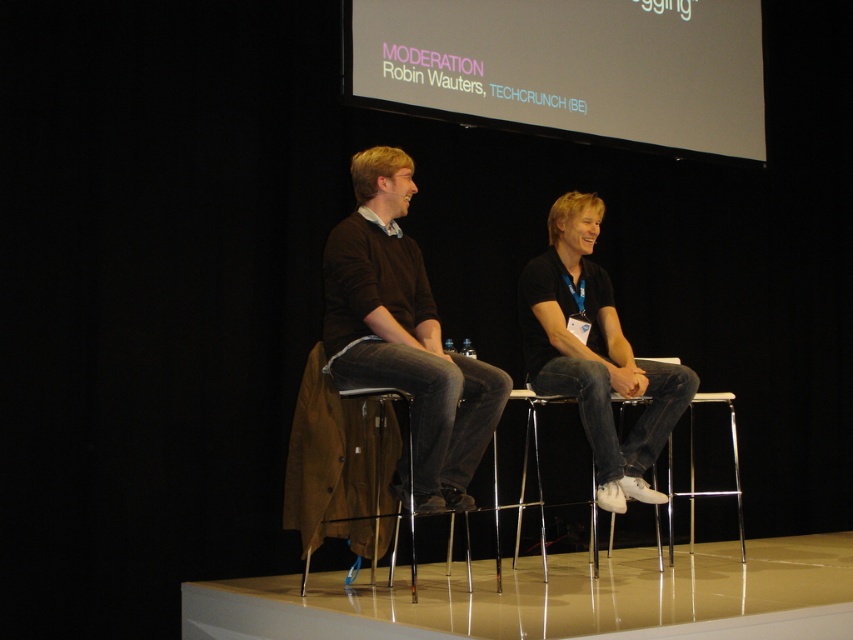
You are an event organizer who needs to ensure that the white matte projection screen at upper center and the matte brown sweater at center are at least 6 feet apart for safety protocols. Based on the scene, can you confirm if they meet the required distance?

The white matte projection screen at upper center and the matte brown sweater at center are 5.14 feet apart from each other, which is less than the required 6 feet. Therefore, they do not meet the safety distance requirement.

You are an event organizer setting up a camera to capture both speakers and the screen during the presentation. Given the positions of the two individuals and the white matte projection screen at upper center, will the camera positioned at the back of the stage have an unobstructed view of both the speakers and the screen?

The white matte projection screen at upper center is located at point (569, 68), which suggests it is positioned higher and to the left relative to the speakers. Since the camera is at the back, it should have an unobstructed view of both the speakers and the screen as long as there are no physical barriers blocking the line of sight. However, the exact positioning would depend on the stage layout not described here. Based on the given information, the answer is yes, the camera can see both.

You are a stagehand standing behind the two speakers. You need to place a microphone stand between the matte brown sweater at center and the black matte shirt at center. Is there enough space to fit a microphone stand that is 24 inches wide?

The distance between the matte brown sweater at center and the black matte shirt at center is 28.09 inches. Since the microphone stand is 24 inches wide, there is sufficient space to place it between them.